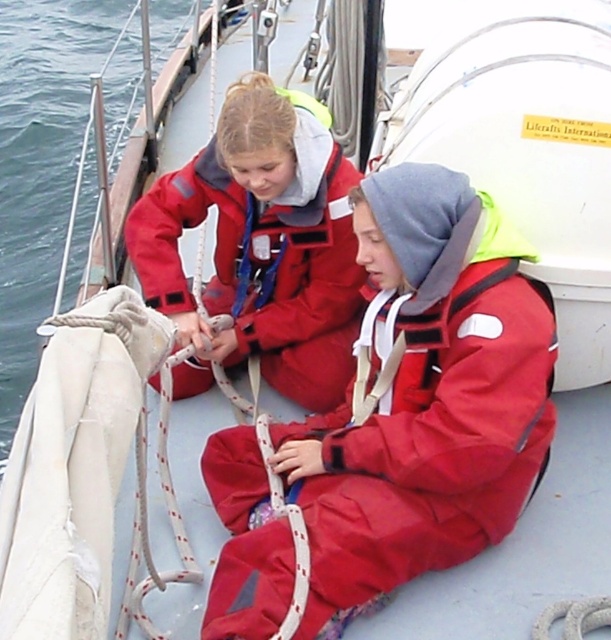
From the picture: Is red matte life jacket at center further to the viewer compared to matte red jacket at upper left?

No, it is not.

Which is behind, point (469, 397) or point (260, 348)?

The point (260, 348) is more distant.

Describe the element at coordinates (423, 397) in the screenshot. I see `red matte life jacket at center` at that location.

Image resolution: width=611 pixels, height=640 pixels. Identify the location of red matte life jacket at center. (423, 397).